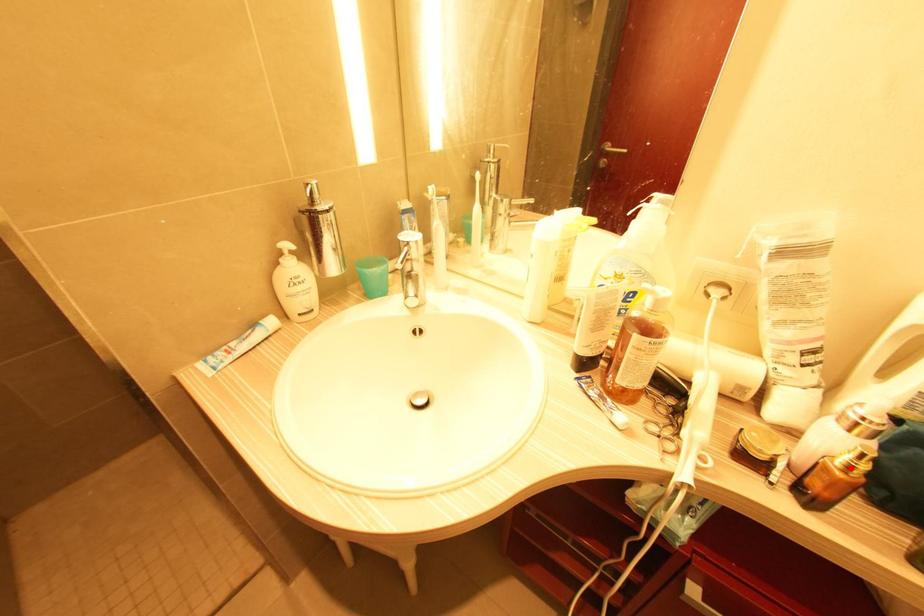
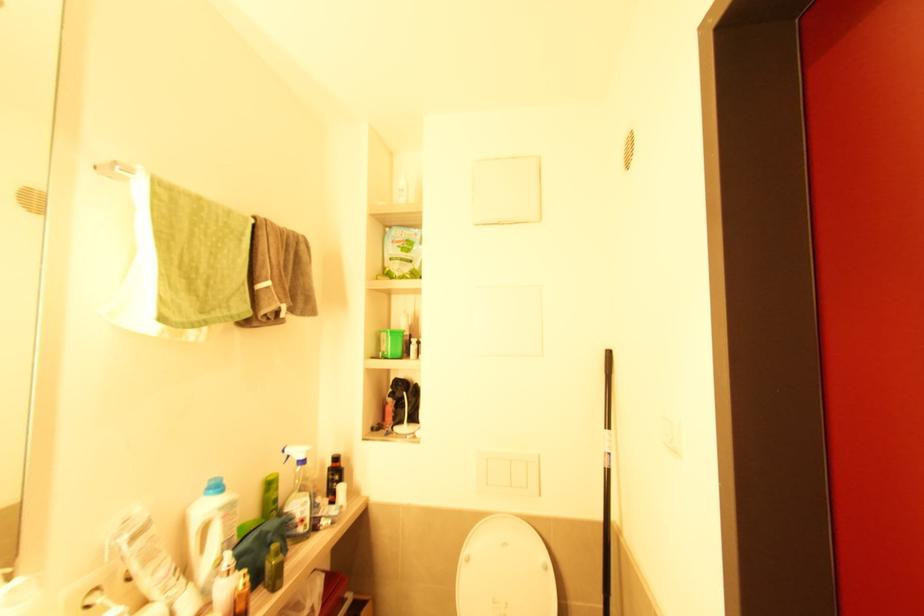
Find the pixel in the second image that matches the highlighted location in the first image.

(247, 585)